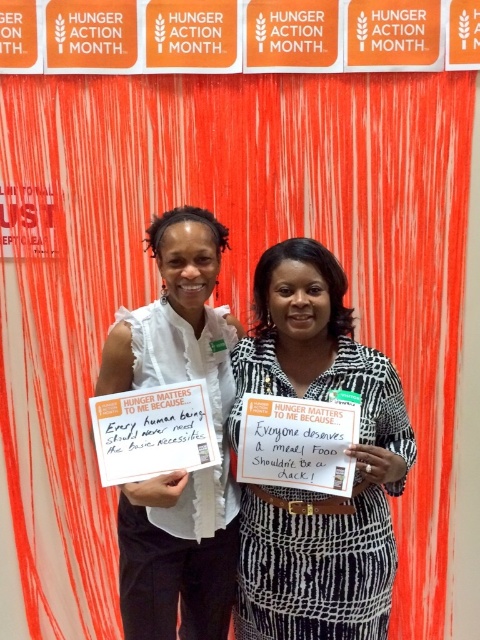
Which is below, white printed signboard at center or white paper sign at center?

white printed signboard at center

Find the location of `white printed signboard at center`. white printed signboard at center is located at coordinates (347, 452).